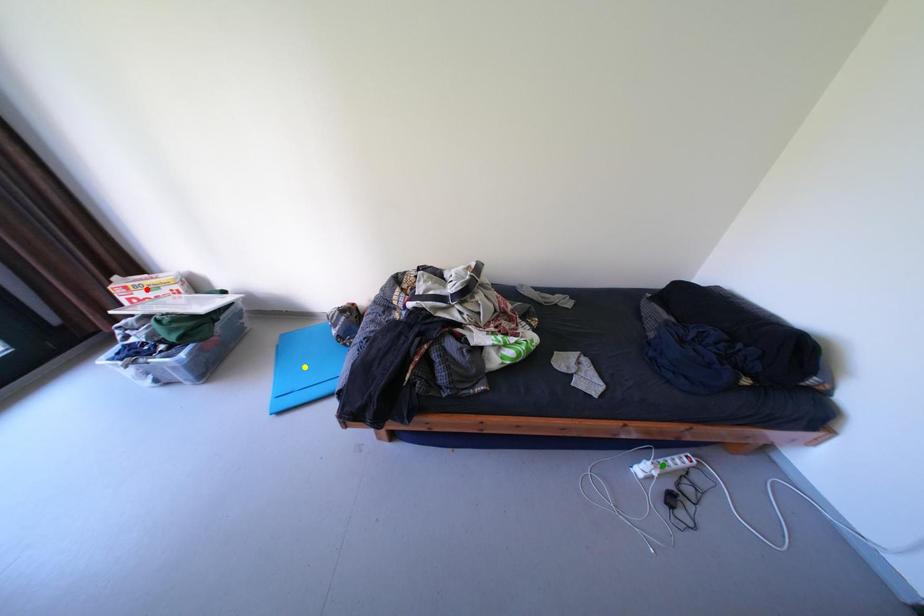
Order these from nearest to farthest:
yellow point
green point
red point

green point
red point
yellow point